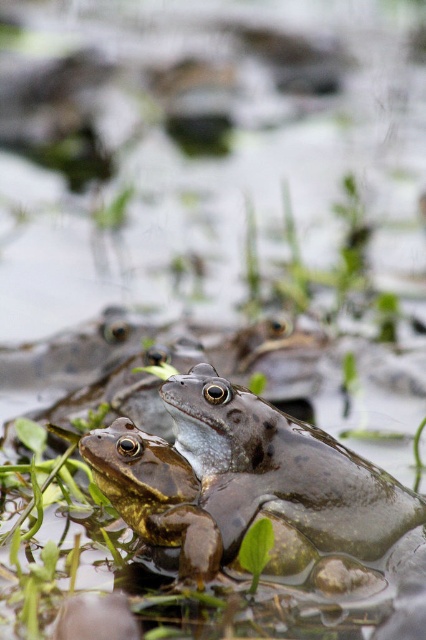
You are a photographer taking a picture of the frogs. You notice two points in the scene labeled as point 1 and point 2. If point 1 is at coordinate point (399, 532) and point 2 is at coordinate point (193, 541), which point is closer to the camera?

Point 2 at coordinate point (193, 541) is closer to the camera than point 1 at coordinate point (399, 532) because the description states that point (399, 532) is further to the camera than point (193, 541).

You are a photographer aiming to capture a closeup of the smooth green frog at center and the green matte frog at center. Which frog will appear larger in the photo if you focus on the one closer to you?

The smooth green frog at center will appear larger in the photo because it is closer to the photographer than the green matte frog at center.

You are a biologist observing two frogs in a pond. You notice a smooth green frog at center and a green matte frog at center. Which frog has a more elevated position above the water surface?

The smooth green frog at center is much taller than the green matte frog at center, so it has a more elevated position above the water surface.